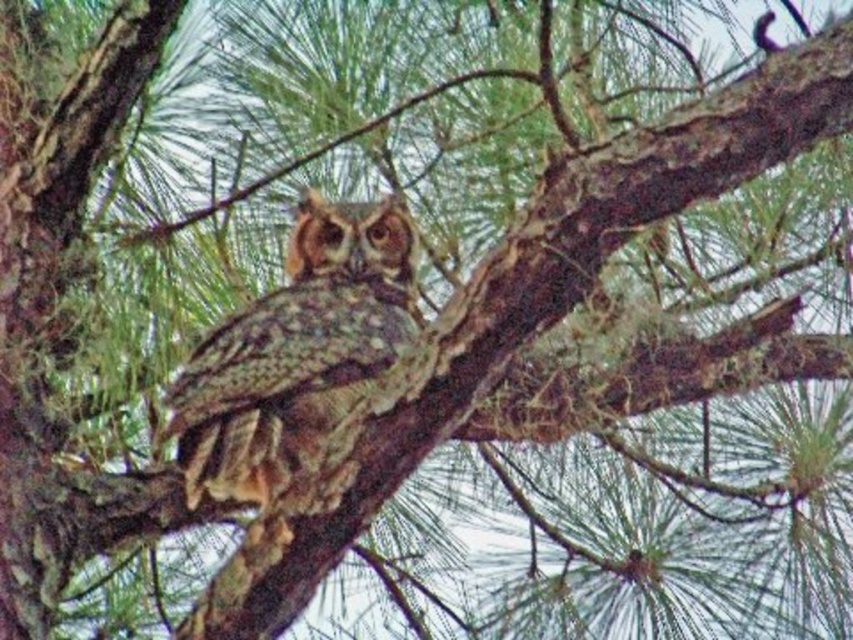
Question: Can you confirm if camouflage feathers owl at center is positioned to the left of brown speckled owl at center?

Choices:
 (A) no
 (B) yes

Answer: (B)

Question: Is camouflage feathers owl at center bigger than brown speckled owl at center?

Choices:
 (A) yes
 (B) no

Answer: (A)

Question: Which object appears closest to the camera in this image?

Choices:
 (A) brown speckled owl at center
 (B) camouflage feathers owl at center

Answer: (A)

Question: Does camouflage feathers owl at center have a greater width compared to brown speckled owl at center?

Choices:
 (A) no
 (B) yes

Answer: (B)

Question: Which object is closer to the camera taking this photo?

Choices:
 (A) brown speckled owl at center
 (B) camouflage feathers owl at center

Answer: (A)